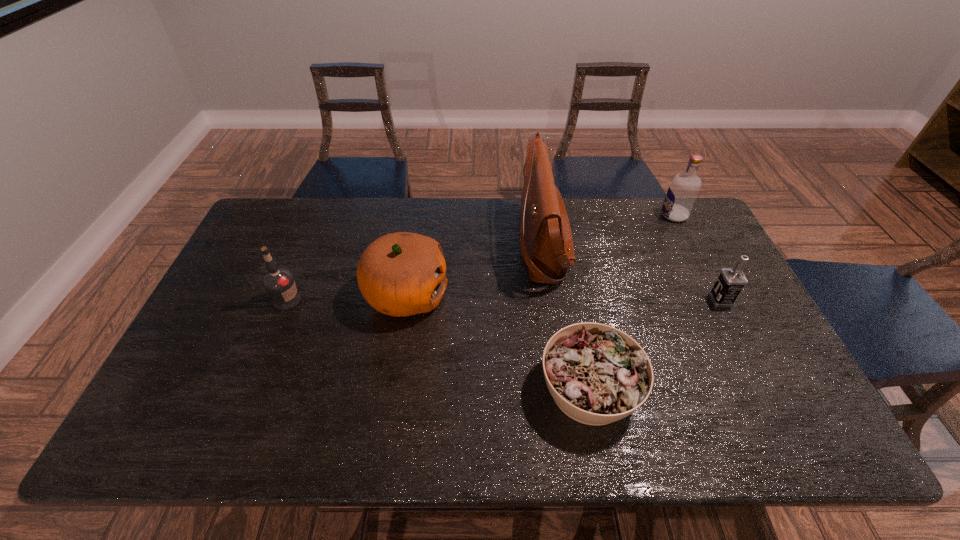
Locate an element on the screen. vacant area that lies between the fifth object from right to left and the tallest object is located at coordinates (474, 269).

I want to click on free area in between the shortest object and the fifth object from right to left, so click(497, 342).

The image size is (960, 540). Identify the location of free space between the pumpkin and the shortest vodka. (564, 298).

Where is `vacant space in between the satchel and the farthest vodka`? The image size is (960, 540). vacant space in between the satchel and the farthest vodka is located at coordinates (608, 230).

The width and height of the screenshot is (960, 540). I want to click on free spot between the pumpkin and the shortest object, so click(497, 342).

Image resolution: width=960 pixels, height=540 pixels. Identify the location of vacant point located between the second shortest object and the leftmost vodka. (504, 300).

Image resolution: width=960 pixels, height=540 pixels. Find the location of `object identified as the fourth closest to the nearest object`. object identified as the fourth closest to the nearest object is located at coordinates (683, 190).

You are a GUI agent. You are given a task and a screenshot of the screen. Output one action in this format:
    pyautogui.click(x=<x>, y=<y>)
    Task: Click on the object that can be found as the fifth closest to the farthest vodka
    The height and width of the screenshot is (540, 960).
    Given the screenshot: What is the action you would take?
    pyautogui.click(x=279, y=283)

The height and width of the screenshot is (540, 960). Identify the location of the second closest vodka to the pumpkin. (683, 190).

Select which vodka appears as the third closest to the shortest object. Please provide its 2D coordinates. Your answer should be formatted as a tuple, i.e. [(x, y)], where the tuple contains the x and y coordinates of a point satisfying the conditions above.

[(279, 283)]